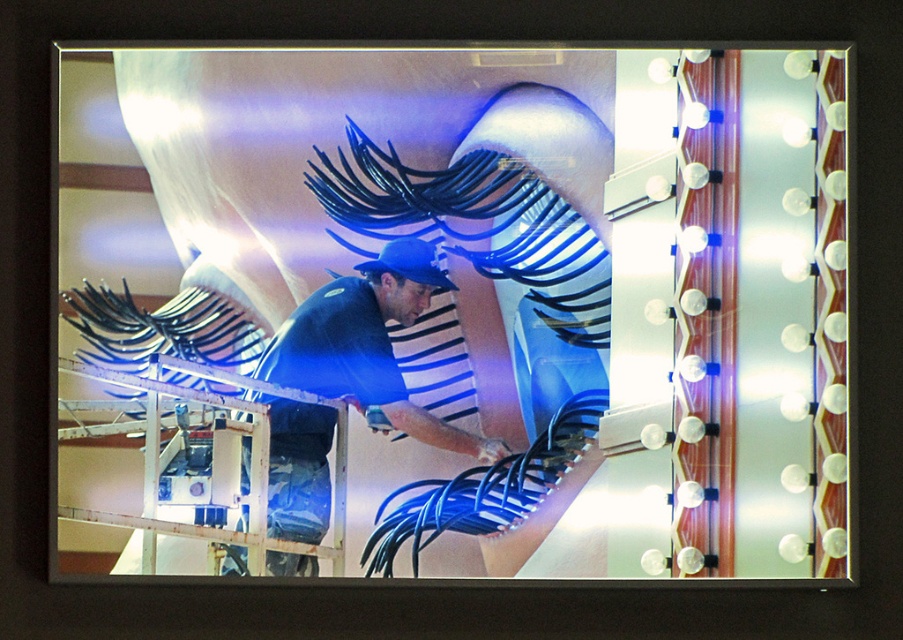
Question: Which of the following is the farthest from the observer?

Choices:
 (A) click(x=592, y=166)
 (B) click(x=396, y=419)

Answer: (A)

Question: Can you confirm if metallic silver mirror at center is smaller than blue matte shirt at center?

Choices:
 (A) no
 (B) yes

Answer: (A)

Question: Can you confirm if metallic silver mirror at center is positioned below blue matte shirt at center?

Choices:
 (A) no
 (B) yes

Answer: (A)

Question: Is metallic silver mirror at center below blue matte shirt at center?

Choices:
 (A) yes
 (B) no

Answer: (B)

Question: Which of the following is the closest to the observer?

Choices:
 (A) blue matte shirt at center
 (B) metallic silver mirror at center

Answer: (A)

Question: Which point is farther from the camera taking this photo?

Choices:
 (A) [309, 180]
 (B) [310, 524]

Answer: (A)